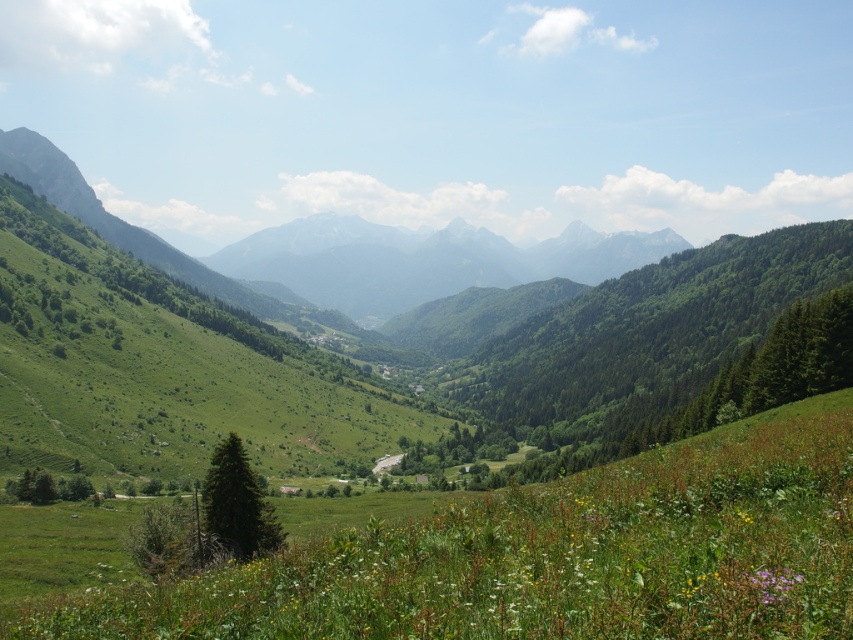
Question: Does green grassy mountain at center come behind purple matte flower at lower right?

Choices:
 (A) yes
 (B) no

Answer: (A)

Question: Which point appears closest to the camera in this image?

Choices:
 (A) (230, 477)
 (B) (762, 595)
 (C) (476, 262)

Answer: (B)

Question: Estimate the real-world distances between objects in this image. Which object is closer to the green matte tree at lower left?

Choices:
 (A) green leafy tree at center
 (B) purple matte flower at lower right
 (C) green grassy mountain at center

Answer: (B)

Question: Can you confirm if green leafy tree at center is positioned to the left of green matte tree at lower left?

Choices:
 (A) yes
 (B) no

Answer: (B)

Question: Which is farther from the purple matte flower at lower right?

Choices:
 (A) green leafy tree at center
 (B) green matte tree at lower left

Answer: (A)

Question: Can you confirm if green leafy tree at center is positioned above green matte tree at lower left?

Choices:
 (A) yes
 (B) no

Answer: (A)